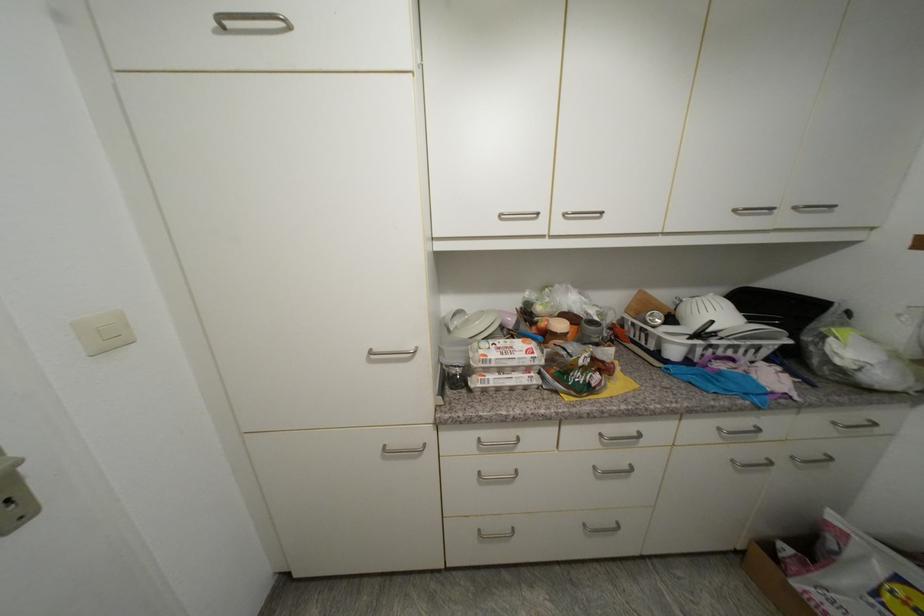
The width and height of the screenshot is (924, 616). I want to click on white colander, so click(x=714, y=472).